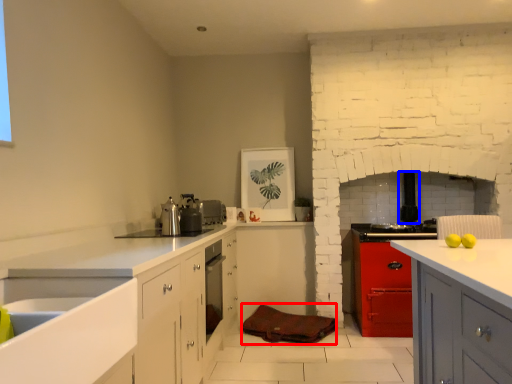
Question: Which point is further to the camera, material (highlighted by a red box) or appliance (highlighted by a blue box)?

Choices:
 (A) material
 (B) appliance

Answer: (B)